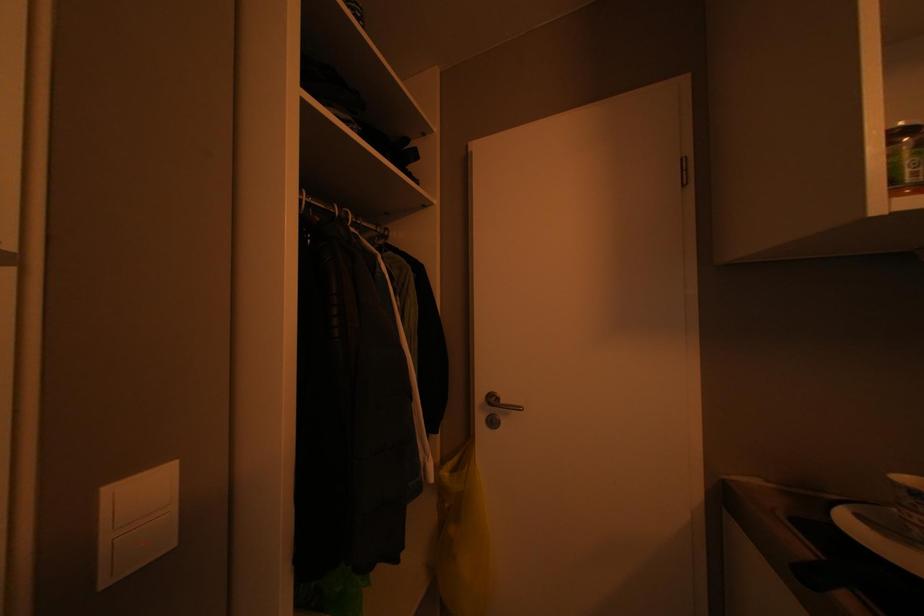
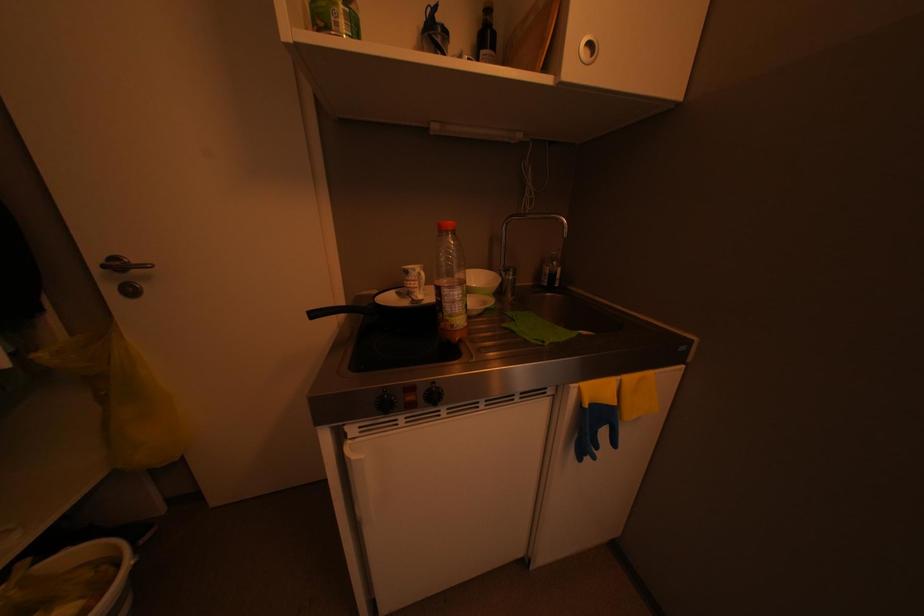
From the picture: Based on the continuous images, in which direction is the camera rotating?

The camera rotated toward right-down.